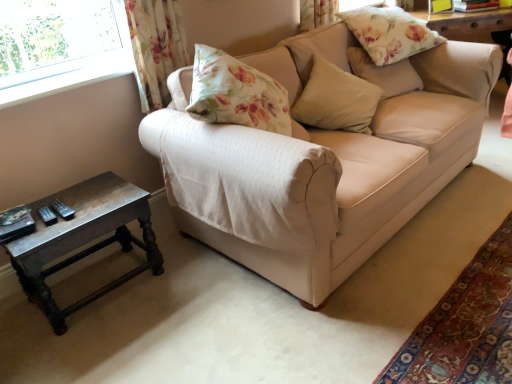
This screenshot has height=384, width=512. I want to click on vacant point above floral fabric pillow at upper right, placed as the second pillow when sorted from bottom to top (from a real-world perspective), so click(386, 32).